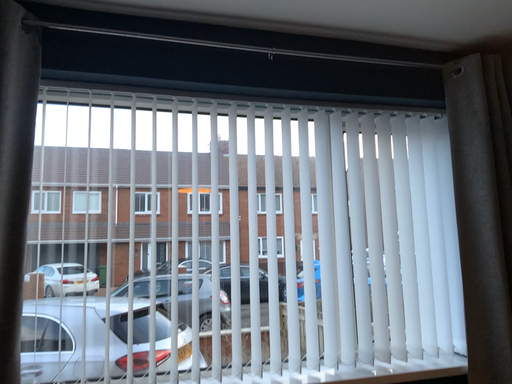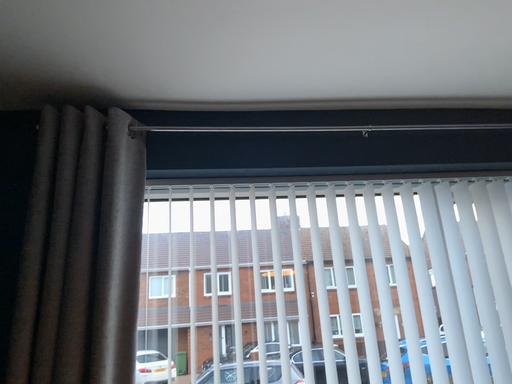
Question: Which way did the camera rotate in the video?

Choices:
 (A) rotated left
 (B) rotated right

Answer: (A)